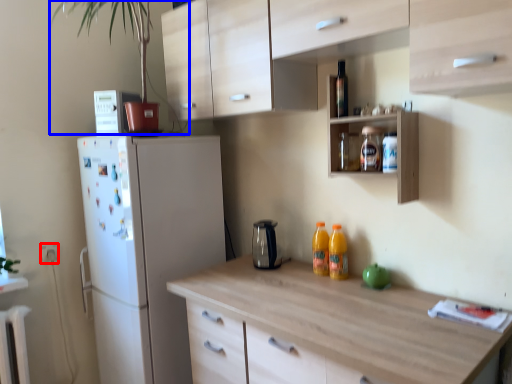
Question: Which object appears closest to the camera in this image, electric outlet (highlighted by a red box) or plant (highlighted by a blue box)?

Choices:
 (A) electric outlet
 (B) plant

Answer: (B)